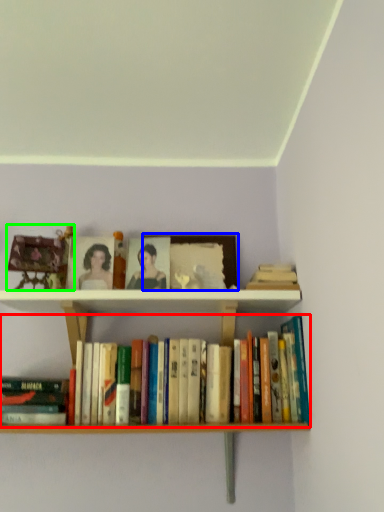
Question: Which is farther away from book (highlighted by a red box)? picture frame (highlighted by a blue box) or toy (highlighted by a green box)?

Choices:
 (A) picture frame
 (B) toy

Answer: (A)